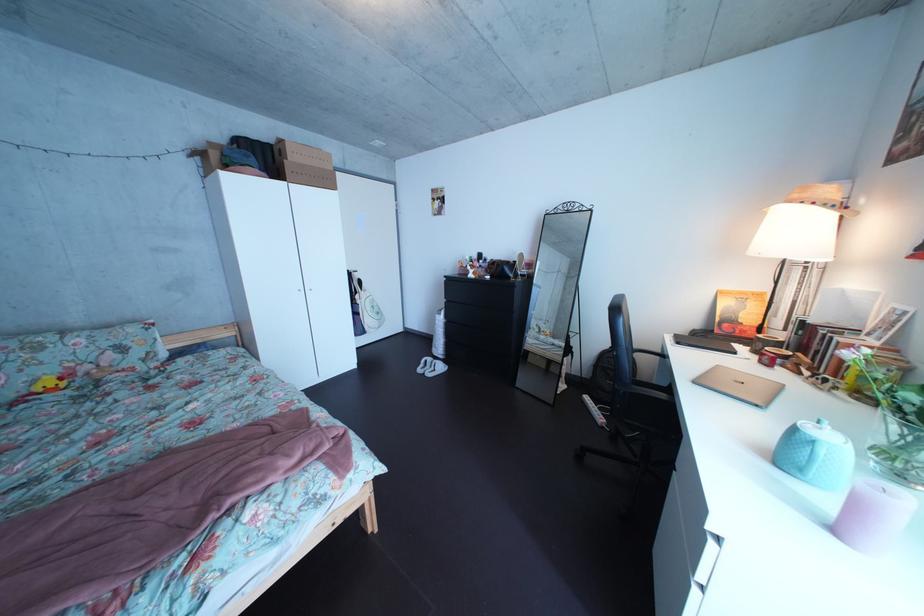
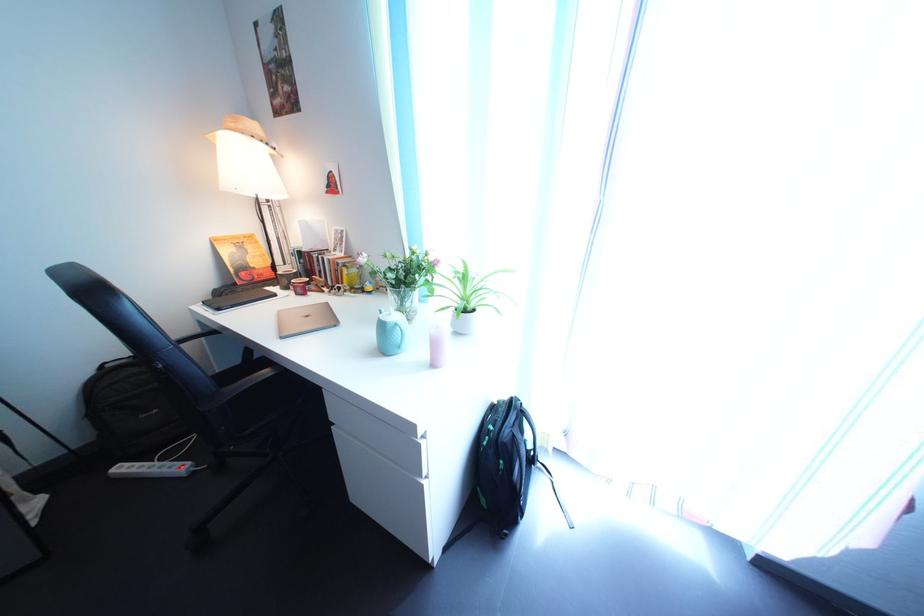
The first image is from the beginning of the video and the second image is from the end. How did the camera likely rotate when shooting the video?

The camera rotated toward right-down.